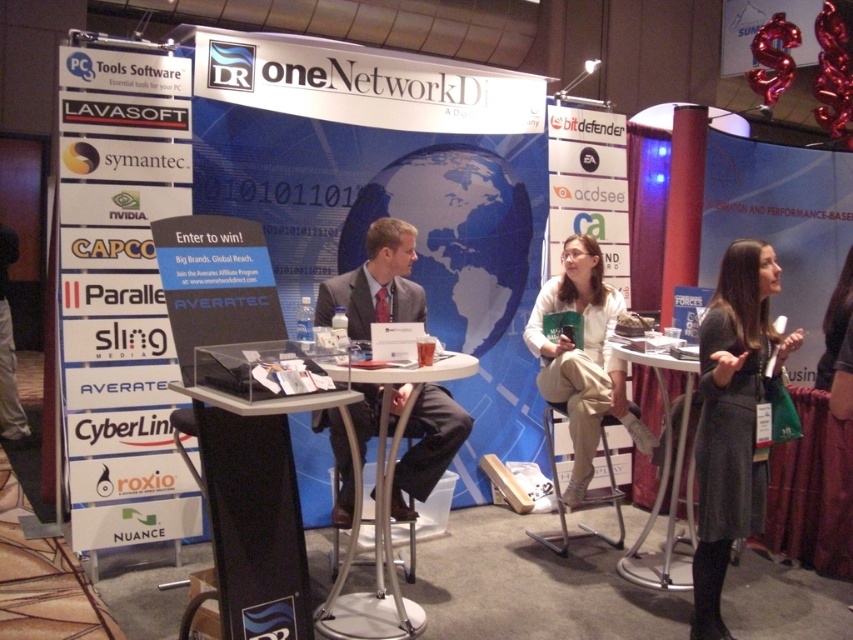
Question: Is dark gray skirt at lower right positioned behind white plastic table at center?

Choices:
 (A) no
 (B) yes

Answer: (B)

Question: Is matte black suit at center above white fabric shirt at center?

Choices:
 (A) yes
 (B) no

Answer: (A)

Question: Which of the following is the farthest from the observer?

Choices:
 (A) (410, 381)
 (B) (663, 406)
 (C) (734, 243)
 (D) (585, 424)

Answer: (B)

Question: Which point is closer to the camera taking this photo?

Choices:
 (A) (735, 352)
 (B) (590, 470)

Answer: (A)

Question: Is matte black suit at center to the right of white fabric shirt at center from the viewer's perspective?

Choices:
 (A) yes
 (B) no

Answer: (B)

Question: Which object is the farthest from the dark gray skirt at lower right?

Choices:
 (A) white fabric shirt at center
 (B) matte black suit at center
 (C) white plastic table at center
 (D) metallic silver table at center

Answer: (B)